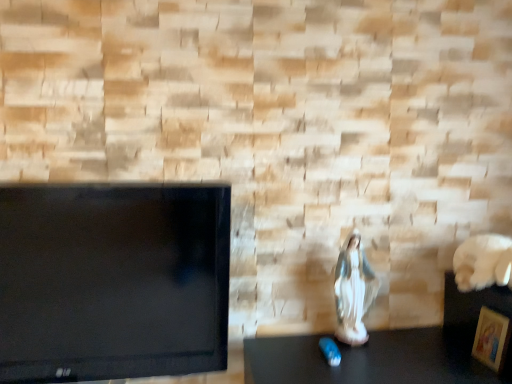
Where is `wooden picture frame at lower right`? This screenshot has width=512, height=384. wooden picture frame at lower right is located at coordinates (492, 338).

Consider the image. What is the approximate height of wooden picture frame at lower right?

wooden picture frame at lower right is 7.95 inches in height.

The image size is (512, 384). Describe the element at coordinates (492, 338) in the screenshot. I see `wooden picture frame at lower right` at that location.

The width and height of the screenshot is (512, 384). In order to click on porcelain statue at center in this screenshot , I will do `click(353, 291)`.

In order to face porcelain statue at center, should I rotate leftwards or rightwards?

To align with it, rotate right about 13.274°.

The height and width of the screenshot is (384, 512). What do you see at coordinates (353, 291) in the screenshot? I see `porcelain statue at center` at bounding box center [353, 291].

Where is `wooden picture frame at lower right`? The image size is (512, 384). wooden picture frame at lower right is located at coordinates (492, 338).

Which is more to the left, porcelain statue at center or wooden picture frame at lower right?

From the viewer's perspective, porcelain statue at center appears more on the left side.

Looking at this image, is porcelain statue at center further to camera compared to wooden picture frame at lower right?

Yes, the depth of porcelain statue at center is greater than that of wooden picture frame at lower right.

Is point (358, 333) closer to viewer compared to point (487, 329)?

No.

From the image's perspective, which one is positioned higher, porcelain statue at center or wooden picture frame at lower right?

porcelain statue at center is shown above in the image.

From a real-world perspective, is porcelain statue at center physically above wooden picture frame at lower right?

Yes.

Which of these two, porcelain statue at center or wooden picture frame at lower right, is wider?

Wider between the two is porcelain statue at center.

Can you confirm if porcelain statue at center is taller than wooden picture frame at lower right?

Correct, porcelain statue at center is much taller as wooden picture frame at lower right.

Considering the relative sizes of porcelain statue at center and wooden picture frame at lower right in the image provided, is porcelain statue at center smaller than wooden picture frame at lower right?

Actually, porcelain statue at center might be larger than wooden picture frame at lower right.

Is wooden picture frame at lower right surrounded by porcelain statue at center?

No, wooden picture frame at lower right is located outside of porcelain statue at center.

Are porcelain statue at center and wooden picture frame at lower right far apart?

No, porcelain statue at center is in close proximity to wooden picture frame at lower right.

Does porcelain statue at center turn towards wooden picture frame at lower right?

No, porcelain statue at center does not turn towards wooden picture frame at lower right.

Can you tell me how much porcelain statue at center and wooden picture frame at lower right differ in facing direction?

There is a 84.7-degree angle between the facing directions of porcelain statue at center and wooden picture frame at lower right.

Find the location of a particular element. picture frame in front of the porcelain statue at center is located at coordinates (492, 338).

Which object is positioned more to the right, wooden picture frame at lower right or porcelain statue at center?

wooden picture frame at lower right.

Between wooden picture frame at lower right and porcelain statue at center, which one is positioned in front?

wooden picture frame at lower right is more forward.

Which is behind, point (477, 357) or point (346, 277)?

The point (346, 277) is more distant.

From the image's perspective, which object appears higher, wooden picture frame at lower right or porcelain statue at center?

porcelain statue at center is shown above in the image.

From a real-world perspective, is wooden picture frame at lower right positioned over porcelain statue at center based on gravity?

No, from a real-world perspective, wooden picture frame at lower right is not over porcelain statue at center

Is wooden picture frame at lower right wider than porcelain statue at center?

Incorrect, the width of wooden picture frame at lower right does not surpass that of porcelain statue at center.

Who is shorter, wooden picture frame at lower right or porcelain statue at center?

With less height is wooden picture frame at lower right.

Is wooden picture frame at lower right smaller than porcelain statue at center?

Correct, wooden picture frame at lower right occupies less space than porcelain statue at center.

Can we say wooden picture frame at lower right lies outside porcelain statue at center?

That's correct, wooden picture frame at lower right is outside of porcelain statue at center.

Is wooden picture frame at lower right placed right next to porcelain statue at center?

No, wooden picture frame at lower right is not touching porcelain statue at center.

Is wooden picture frame at lower right oriented towards porcelain statue at center?

No, wooden picture frame at lower right does not turn towards porcelain statue at center.

How different are the orientations of wooden picture frame at lower right and porcelain statue at center in degrees?

The angle between the facing direction of wooden picture frame at lower right and the facing direction of porcelain statue at center is 84.7 degrees.

Where is `picture frame lying in front of the porcelain statue at center`? picture frame lying in front of the porcelain statue at center is located at coordinates (492, 338).

Image resolution: width=512 pixels, height=384 pixels. I want to click on picture frame below the porcelain statue at center (from the image's perspective), so click(492, 338).

Locate an element on the screen. The image size is (512, 384). picture frame that appears on the right of porcelain statue at center is located at coordinates (492, 338).